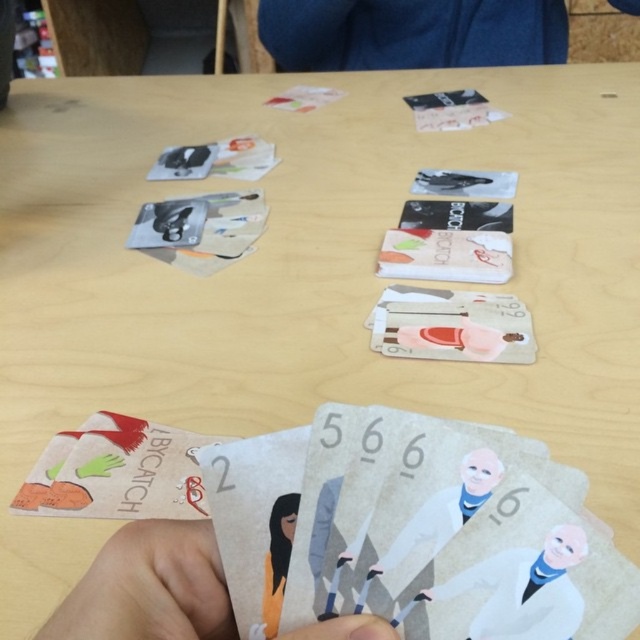
You are organizing a card game and need to place the blue fabric at upper center and the smooth white coat at center on the table. According to the image, which object is covering the other?

The blue fabric at upper center is positioned over the smooth white coat at center, so it is covering the other object.

You are organizing items on a table and need to place a new item between the blue fabric at upper center and the smooth white coat at center. Based on their positions, where should you place the new item?

The blue fabric at upper center is to the right of the smooth white coat at center, so you should place the new item between them by positioning it to the left of the blue fabric at upper center and to the right of the smooth white coat at center.

You are playing a card game called Big Catch. You have two cards in your hand. One has a smooth white coat at center and the other has a white paper character at center. Which card is larger in size?

The smooth white coat at center is smaller than the white paper character at center, so the white paper character at center is larger in size.